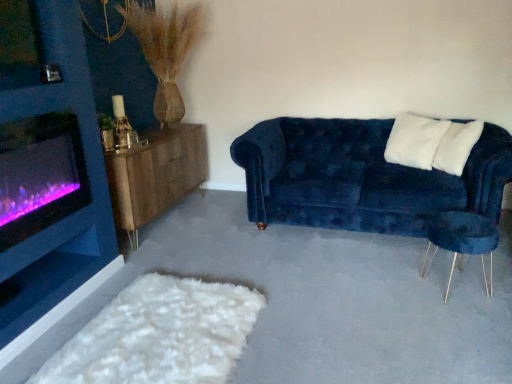
Question: Is purple glass wood burning stove at left turned away from velvet blue couch at right?

Choices:
 (A) yes
 (B) no

Answer: (B)

Question: Does purple glass wood burning stove at left come behind velvet blue couch at right?

Choices:
 (A) no
 (B) yes

Answer: (A)

Question: Is purple glass wood burning stove at left at the left side of velvet blue couch at right?

Choices:
 (A) no
 (B) yes

Answer: (B)

Question: Considering the relative sizes of purple glass wood burning stove at left and velvet blue couch at right in the image provided, is purple glass wood burning stove at left taller than velvet blue couch at right?

Choices:
 (A) yes
 (B) no

Answer: (B)

Question: Could you tell me if purple glass wood burning stove at left is turned towards velvet blue couch at right?

Choices:
 (A) no
 (B) yes

Answer: (A)

Question: From a real-world perspective, is white fluffy pillow at upper right, marked as the 2th pillow in a left-to-right arrangement, above or below wooden sideboard at left?

Choices:
 (A) below
 (B) above

Answer: (B)

Question: Is white fluffy pillow at upper right, the 1th pillow when ordered from right to left, inside the boundaries of wooden sideboard at left, or outside?

Choices:
 (A) outside
 (B) inside

Answer: (A)

Question: Is white fluffy pillow at upper right, the 1th pillow when ordered from right to left, taller or shorter than wooden sideboard at left?

Choices:
 (A) tall
 (B) short

Answer: (B)

Question: From the image's perspective, is white fluffy pillow at upper right, the 1th pillow when ordered from right to left, positioned above or below wooden sideboard at left?

Choices:
 (A) below
 (B) above

Answer: (B)

Question: Is velvet blue armchair at right in front of or behind wooden sideboard at left in the image?

Choices:
 (A) front
 (B) behind

Answer: (A)

Question: Looking at their shapes, would you say velvet blue armchair at right is wider or thinner than wooden sideboard at left?

Choices:
 (A) wide
 (B) thin

Answer: (B)

Question: Looking at the image, does velvet blue armchair at right seem bigger or smaller compared to wooden sideboard at left?

Choices:
 (A) small
 (B) big

Answer: (A)

Question: Does point (428, 226) appear closer or farther from the camera than point (184, 158)?

Choices:
 (A) farther
 (B) closer

Answer: (B)

Question: From a real-world perspective, is white fluffy pillow at upper right, marked as the 2th pillow in a left-to-right arrangement, physically located above or below purple glass wood burning stove at left?

Choices:
 (A) above
 (B) below

Answer: (B)

Question: Is white fluffy pillow at upper right, marked as the 2th pillow in a left-to-right arrangement, in front of or behind purple glass wood burning stove at left in the image?

Choices:
 (A) front
 (B) behind

Answer: (B)